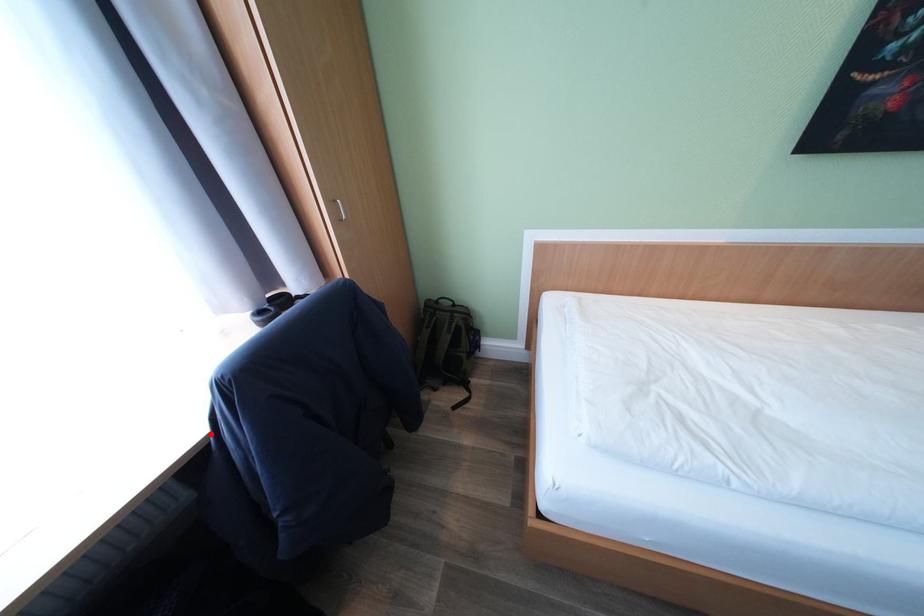
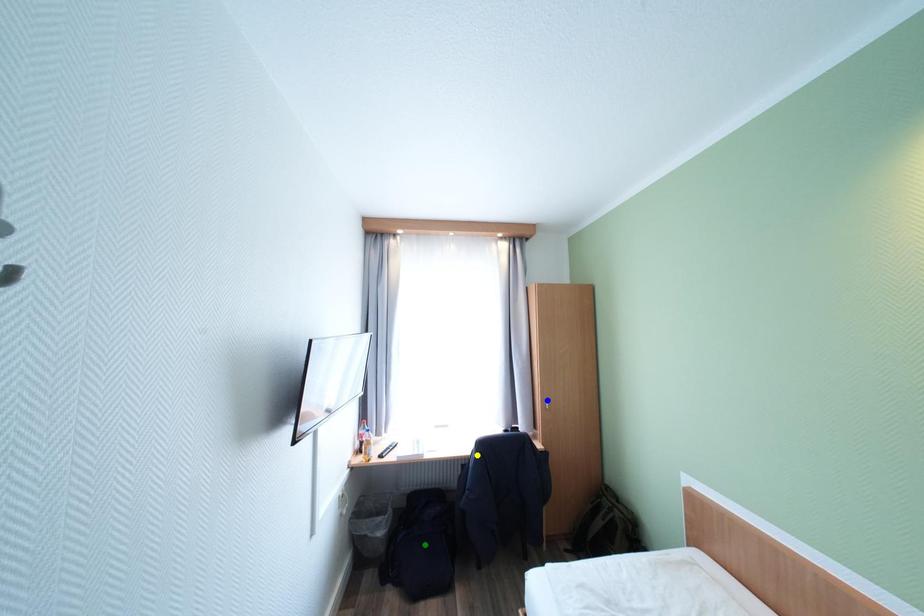
Question: I am providing you with two images of the same scene from different viewpoints. A red point is marked on the first image. You are given multiple points on the second image. Which point in image 2 represents the same 3d spot as the red point in image 1?

Choices:
 (A) yellow point
 (B) green point
 (C) blue point

Answer: (A)